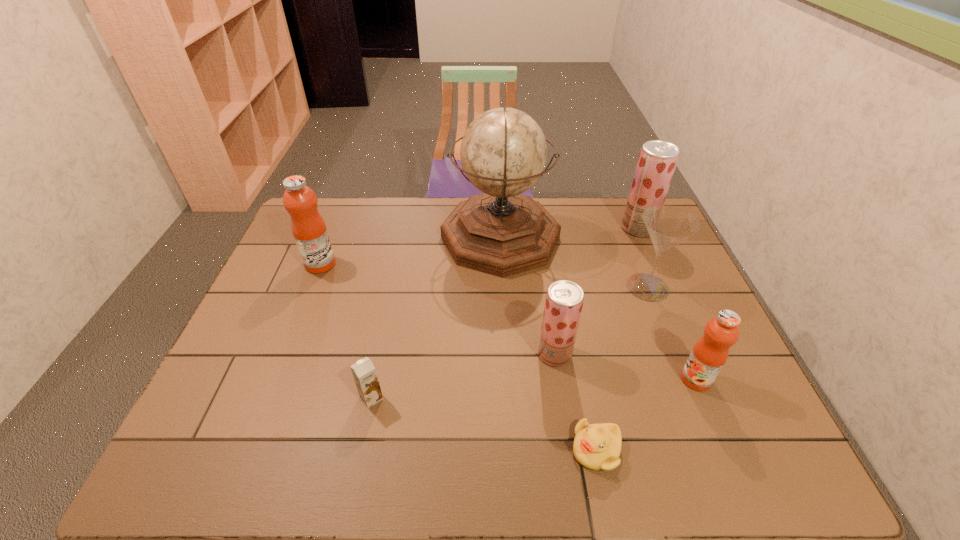
Locate which object is the closest to the farthest fruit juice. Please provide its 2D coordinates. Your answer should be formatted as a tuple, i.e. [(x, y)], where the tuple contains the x and y coordinates of a point satisfying the conditions above.

[(668, 226)]

Where is `the closest fruit juice to the right orange fruit juice`? The image size is (960, 540). the closest fruit juice to the right orange fruit juice is located at coordinates (564, 300).

At what (x,y) coordinates should I click in order to perform the action: click on fruit juice object that ranks as the fourth closest to the flute glass. Please return your answer as a coordinate pair (x, y). This screenshot has height=540, width=960. Looking at the image, I should click on (309, 230).

Identify the location of vacant position in the image that satisfies the following two spatial constraints: 1. on the front label of the leftmost fruit juice; 2. on the right side of the second shortest object. (267, 397).

Find the location of a particular element. Image resolution: width=960 pixels, height=540 pixels. vacant point that satisfies the following two spatial constraints: 1. on the front label of the leftmost object; 2. on the back side of the second fruit juice from left to right is located at coordinates (284, 354).

At what (x,y) coordinates should I click in order to perform the action: click on vacant space that satisfies the following two spatial constraints: 1. on the surface of the nearer strawberry fruit juice; 2. on the right side of the tallest object. Please return your answer as a coordinate pair (x, y). The image size is (960, 540). Looking at the image, I should click on (507, 354).

The image size is (960, 540). I want to click on free space that satisfies the following two spatial constraints: 1. on the surface of the globe; 2. on the back side of the flute glass, so click(x=503, y=287).

Find the location of `free spot that satisfies the following two spatial constraints: 1. on the surface of the tallest object; 2. on the back side of the flute glass`. free spot that satisfies the following two spatial constraints: 1. on the surface of the tallest object; 2. on the back side of the flute glass is located at coordinates (503, 287).

Identify the location of vacant space that satisfies the following two spatial constraints: 1. on the back side of the flute glass; 2. on the surface of the globe. Image resolution: width=960 pixels, height=540 pixels. (628, 238).

Find the location of a particular element. vacant space that satisfies the following two spatial constraints: 1. on the front label of the farther orange fruit juice; 2. on the back side of the seventh object from right to left is located at coordinates (267, 397).